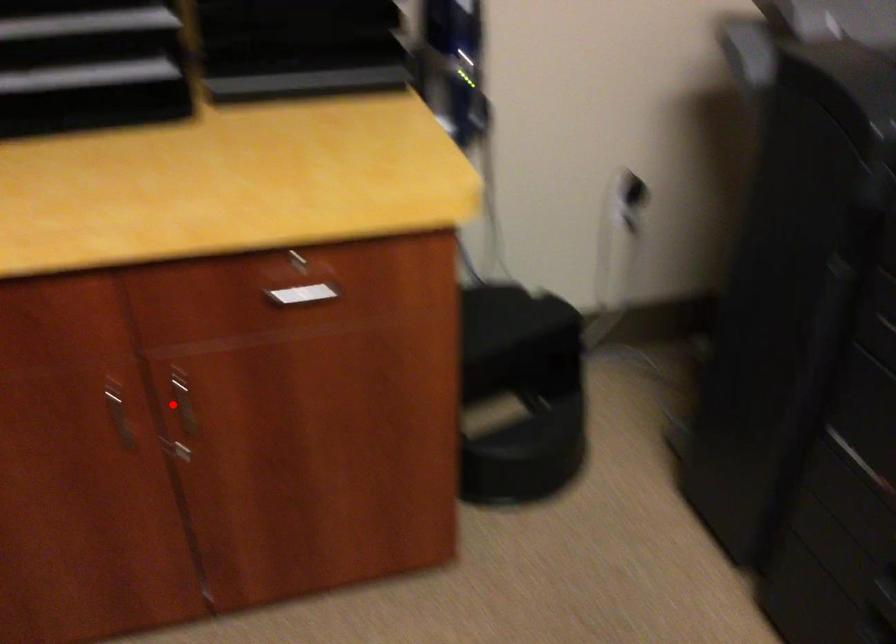
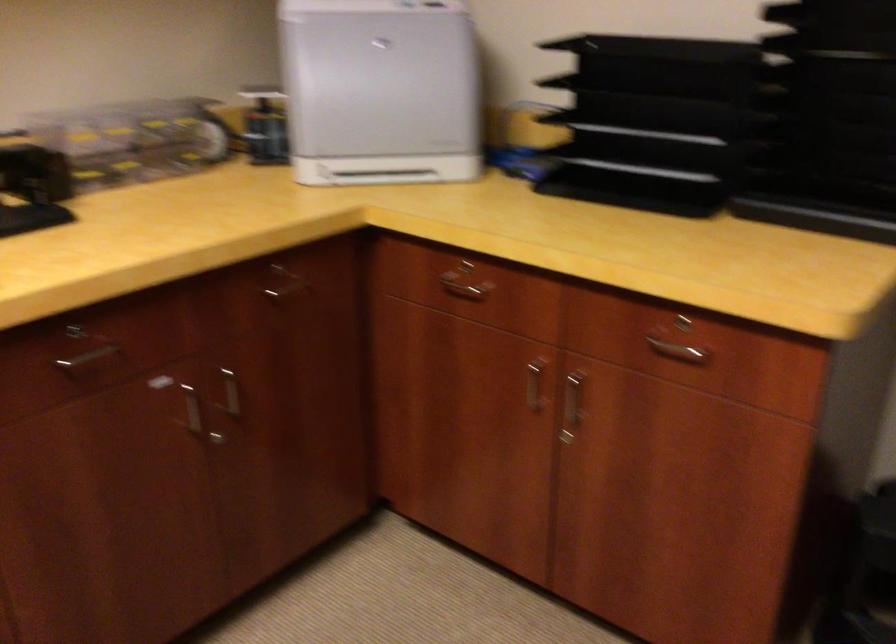
Question: I am providing you with two images of the same scene from different viewpoints. Image1 has a red point marked. In image2, the corresponding 3D location appears at what relative position? Reply with the corresponding letter.

Choices:
 (A) Closer
 (B) Farther

Answer: (B)